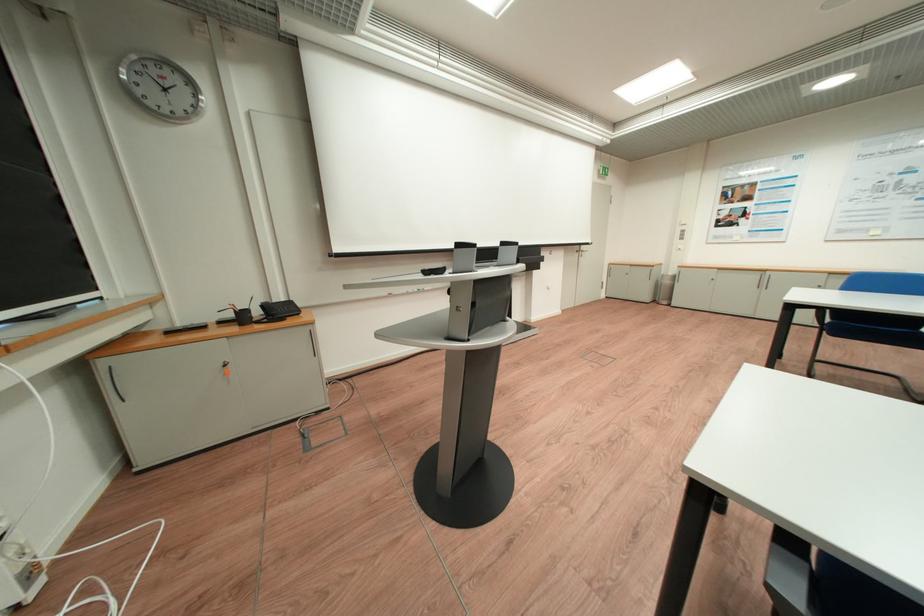
This screenshot has width=924, height=616. In order to click on black cabinet handle in this screenshot , I will do `click(114, 384)`.